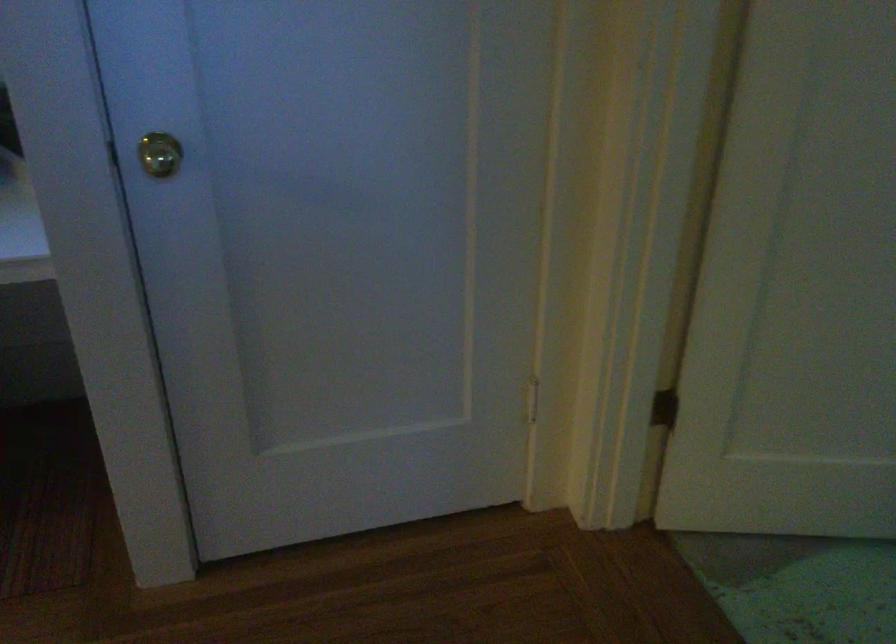
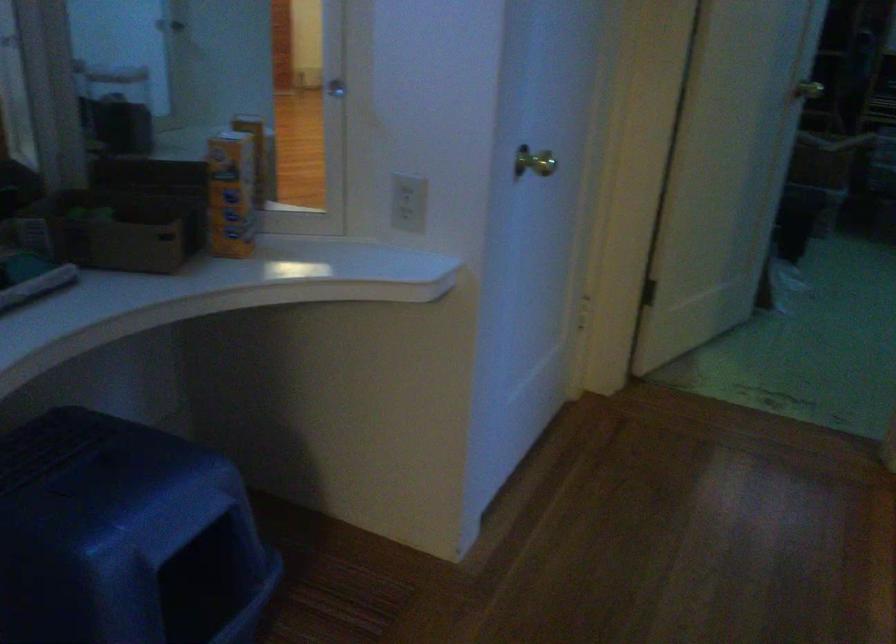
The point at (192,180) is marked in the first image. Where is the corresponding point in the second image?

(533, 162)